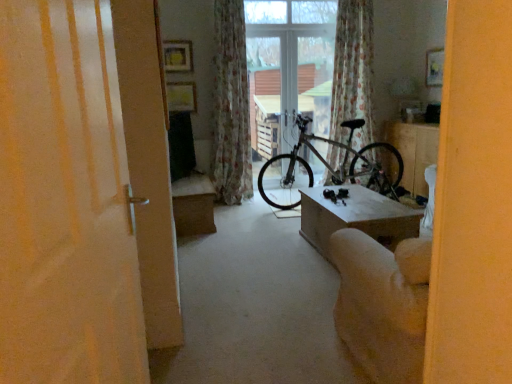
Question: Is point (424, 145) closer or farther from the camera than point (263, 173)?

Choices:
 (A) closer
 (B) farther

Answer: (A)

Question: Choose the correct answer: Is white glossy table at center, positioned as the 1th table in right-to-left order, inside silver metallic bicycle at center or outside it?

Choices:
 (A) outside
 (B) inside

Answer: (A)

Question: Which object is the farthest from the white glossy table at center, the second table in the front-to-back sequence?

Choices:
 (A) silver metallic bicycle at center
 (B) matte white door at left
 (C) floral fabric curtain at upper center, positioned as the 2th curtain in left-to-right order
 (D) beige fabric armchair at lower right
 (E) transparent glass window at center

Answer: (B)

Question: Which of these objects is positioned closest to the beige fabric armchair at lower right?

Choices:
 (A) white glossy table at center, positioned as the 1th table in right-to-left order
 (B) transparent glass window at center
 (C) floral fabric curtain at upper center, the first curtain viewed from the right
 (D) silver metallic bicycle at center
 (E) matte white door at left

Answer: (E)